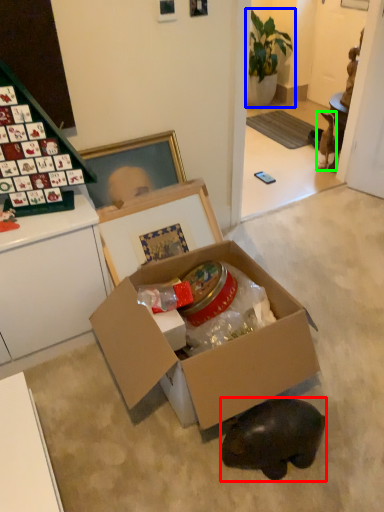
Question: Which object is the closest to the animal (highlighted by a red box)? Choose among these: houseplant (highlighted by a blue box) or animal (highlighted by a green box).

Choices:
 (A) houseplant
 (B) animal

Answer: (B)